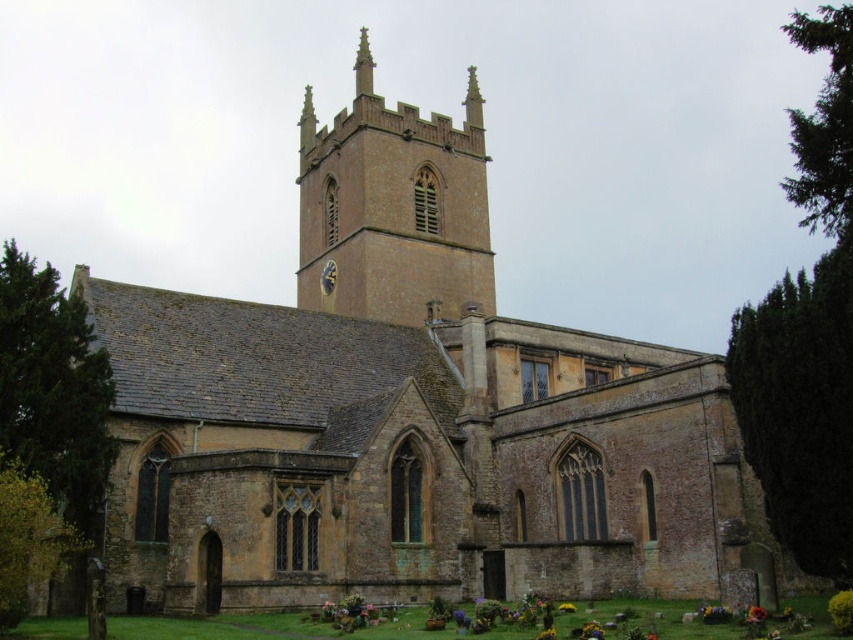
From the picture: Which of these two, smooth stone spire at upper center or vibrant yellow petals at lower center, stands shorter?

With less height is vibrant yellow petals at lower center.

Which is behind, point (367, 56) or point (595, 620)?

Positioned behind is point (367, 56).

Locate an element on the screen. The height and width of the screenshot is (640, 853). smooth stone spire at upper center is located at coordinates (363, 65).

Where is `smooth stone spire at upper center`? The image size is (853, 640). smooth stone spire at upper center is located at coordinates coord(363,65).

Does smooth stone spire at upper center lie behind purple matte flower at center?

Yes.

Is point (364, 68) in front of point (459, 620)?

That is False.

You are a GUI agent. You are given a task and a screenshot of the screen. Output one action in this format:
    pyautogui.click(x=<x>, y=<y>)
    Task: Click on the smooth stone spire at upper center
    
    Given the screenshot: What is the action you would take?
    pyautogui.click(x=363, y=65)

Which is below, purple matte flower at center or yellow matte flower at lower center?

Positioned lower is yellow matte flower at lower center.

Can you confirm if purple matte flower at center is thinner than yellow matte flower at lower center?

Yes, purple matte flower at center is thinner than yellow matte flower at lower center.

Looking at this image, who is more distant from viewer, (456, 621) or (558, 609)?

Positioned behind is point (558, 609).

In order to click on purple matte flower at center in this screenshot , I will do `click(459, 618)`.